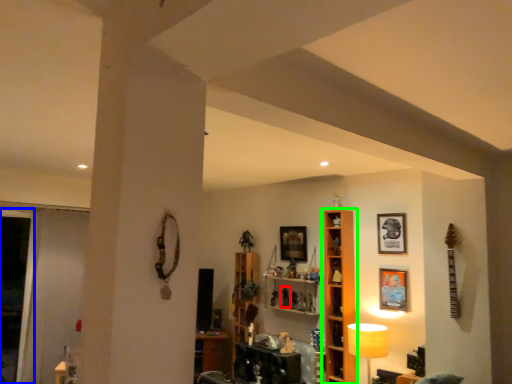
Question: Based on their relative distances, which object is farther from toy (highlighted by a red box)? Choose from glass door (highlighted by a blue box) and shelf (highlighted by a green box).

Choices:
 (A) glass door
 (B) shelf

Answer: (A)